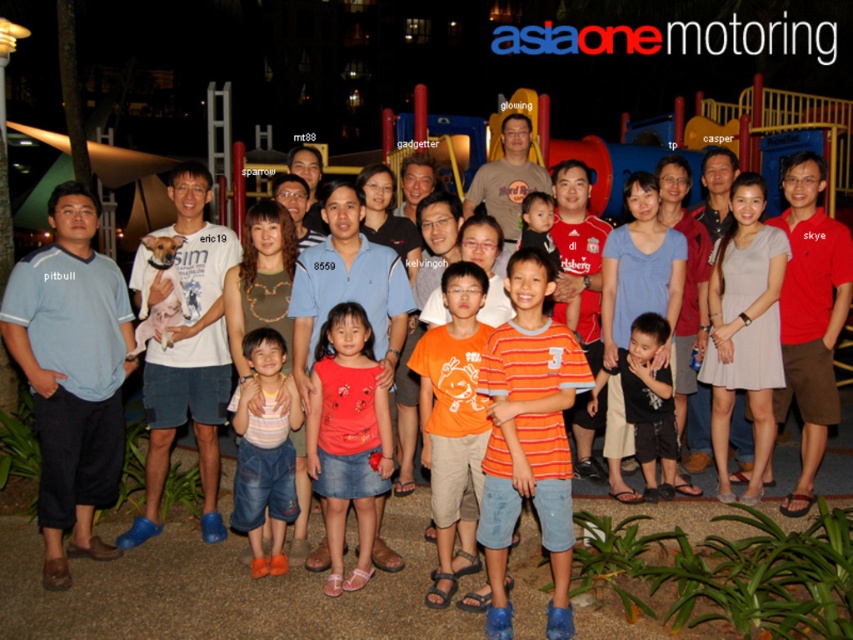
Question: Which point appears closest to the camera in this image?

Choices:
 (A) (x=273, y=372)
 (B) (x=648, y=388)
 (C) (x=453, y=476)
 (D) (x=318, y=467)

Answer: (C)

Question: Estimate the real-world distances between objects in this image. Which object is farther from the striped cotton shirt at center?

Choices:
 (A) orange cotton shirt at center
 (B) black cotton shirt at center
 (C) matte red shirt at center

Answer: (B)

Question: Is striped cotton shirt at center to the right of black cotton shirt at center from the viewer's perspective?

Choices:
 (A) yes
 (B) no

Answer: (B)

Question: Which object is positioned closest to the matte red shirt at center?

Choices:
 (A) black cotton shirt at center
 (B) striped cotton shirt at center
 (C) orange cotton shirt at center

Answer: (B)

Question: Can you confirm if matte red shirt at center is wider than striped cotton shirt at center?

Choices:
 (A) no
 (B) yes

Answer: (B)

Question: Is orange cotton shirt at center thinner than striped cotton shirt at center?

Choices:
 (A) yes
 (B) no

Answer: (B)